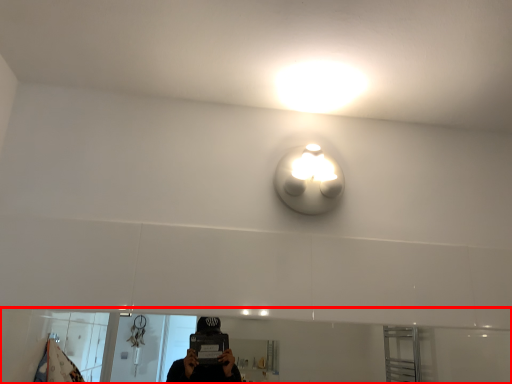
Question: Observing the image, what is the correct spatial positioning of mirror (annotated by the red box) in reference to light?

Choices:
 (A) left
 (B) right

Answer: (A)